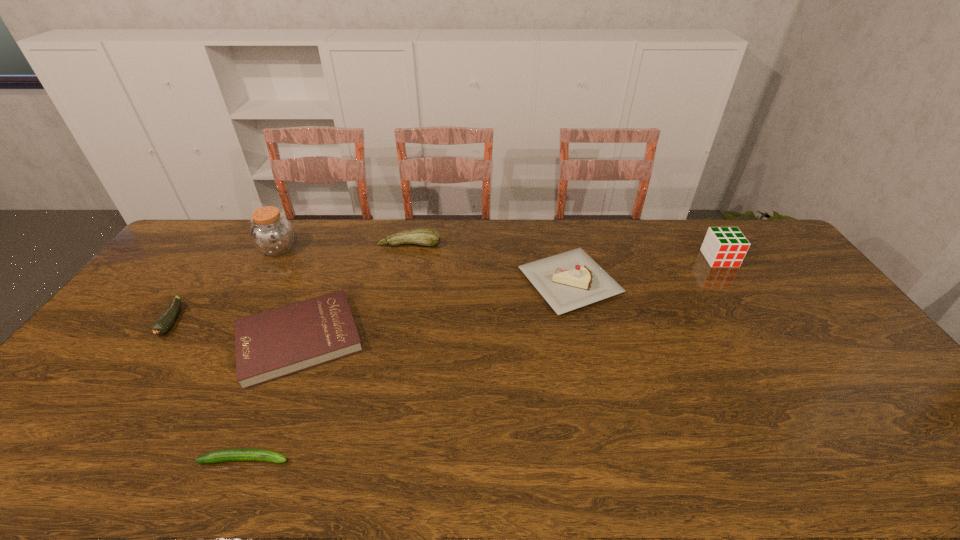
Where is `the nearest object`? This screenshot has height=540, width=960. the nearest object is located at coordinates (227, 455).

Identify the location of the second zucchini from left to right. The height and width of the screenshot is (540, 960). (227, 455).

This screenshot has width=960, height=540. I want to click on vacant region located 0.100m on the left of the jar, so click(x=231, y=249).

This screenshot has width=960, height=540. Identify the location of free location located on the red face of the cube. (732, 277).

What are the coordinates of `vacant space situated on the front of the fifth shortest object` in the screenshot? It's located at (598, 408).

Image resolution: width=960 pixels, height=540 pixels. What are the coordinates of `vacant space located 0.320m at the stem end of the tallest zucchini` in the screenshot? It's located at (396, 313).

Locate an element on the screen. This screenshot has width=960, height=540. blank space located at the blossom end of the second nearest zucchini is located at coordinates (148, 355).

The height and width of the screenshot is (540, 960). I want to click on free space located on the left of the hardback book, so click(174, 339).

The width and height of the screenshot is (960, 540). What are the coordinates of `vacant space located 0.220m on the front-facing side of the nearest zucchini` in the screenshot? It's located at (386, 460).

The width and height of the screenshot is (960, 540). I want to click on jar at the far edge, so click(271, 233).